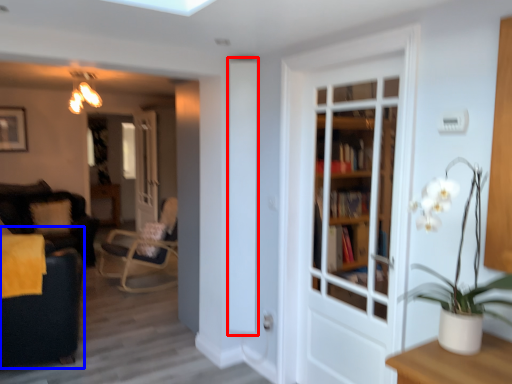
Question: Which of the following is the farthest to the observer, screen door (highlighted by a red box) or swivel chair (highlighted by a blue box)?

Choices:
 (A) screen door
 (B) swivel chair

Answer: (A)